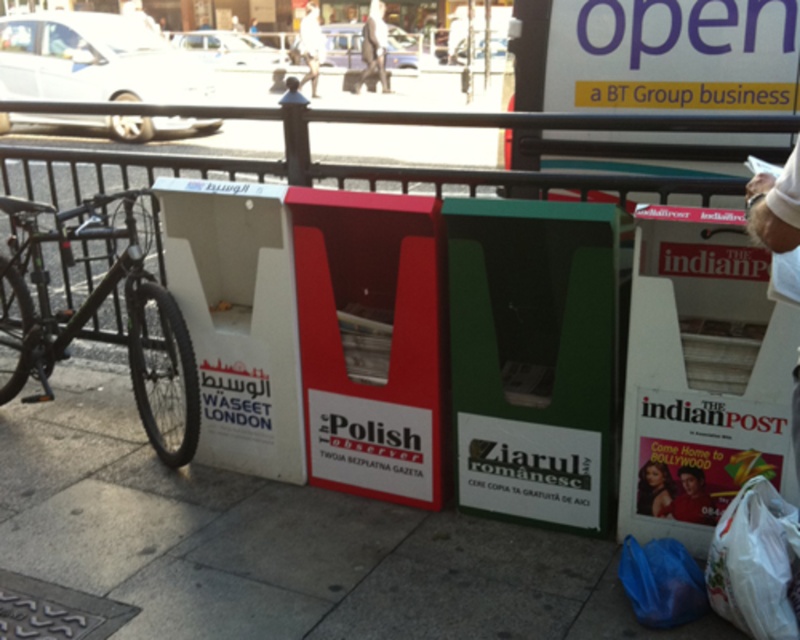
Question: Which point is farther to the camera?

Choices:
 (A) light beige shirt at upper center
 (B) white cardboard sign at center
 (C) blue plastic bag at lower center
 (D) green matte bicycle at left

Answer: (A)

Question: Which object is closer to the camera taking this photo?

Choices:
 (A) blue plastic bag at lower center
 (B) white plastic bag at lower right

Answer: (B)

Question: Which point appears closest to the camera in this image?

Choices:
 (A) (376, 61)
 (B) (168, 374)
 (C) (300, 496)

Answer: (C)

Question: Can you confirm if white cardboard sign at center is smaller than light beige shirt at upper center?

Choices:
 (A) yes
 (B) no

Answer: (A)

Question: Does light gray shirt at center have a smaller size compared to light beige shirt at upper center?

Choices:
 (A) yes
 (B) no

Answer: (A)

Question: Is green matte bicycle at left smaller than blue plastic bag at lower center?

Choices:
 (A) no
 (B) yes

Answer: (A)